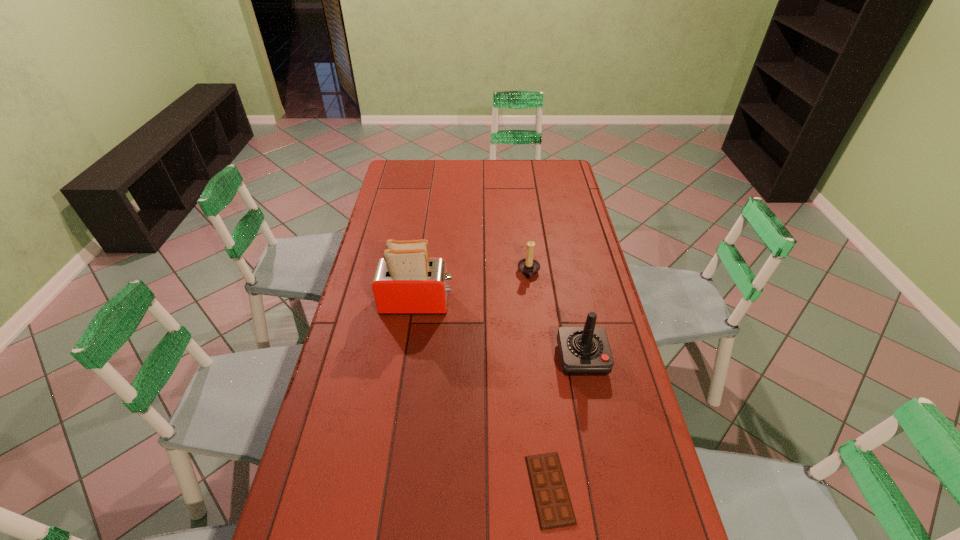
Find the location of a particular element. The width and height of the screenshot is (960, 540). free space located 0.260m on the wick of the farthest object is located at coordinates (449, 273).

At what (x,y) coordinates should I click in order to perform the action: click on vacant space situated 0.220m on the wick of the farthest object. Please return your answer as a coordinate pair (x, y). The width and height of the screenshot is (960, 540). Looking at the image, I should click on (460, 273).

Where is `free point located 0.220m on the wick of the farthest object`? This screenshot has height=540, width=960. free point located 0.220m on the wick of the farthest object is located at coordinates (460, 273).

At what (x,y) coordinates should I click in order to perform the action: click on free spot located on the back of the nearest object. Please return your answer as a coordinate pair (x, y). Image resolution: width=960 pixels, height=540 pixels. Looking at the image, I should click on (539, 394).

Find the location of a particular element. object positioned at the left edge is located at coordinates (406, 282).

What are the coordinates of `object that is at the right edge` in the screenshot? It's located at (584, 351).

Find the location of a particular element. vacant area at the far edge of the desktop is located at coordinates (458, 179).

Find the location of a particular element. Image resolution: width=960 pixels, height=540 pixels. vacant space at the left edge of the desktop is located at coordinates (363, 277).

This screenshot has height=540, width=960. Find the location of `free space at the right edge of the desktop`. free space at the right edge of the desktop is located at coordinates (559, 213).

I want to click on empty space between the second shortest object and the third farthest object, so click(x=555, y=315).